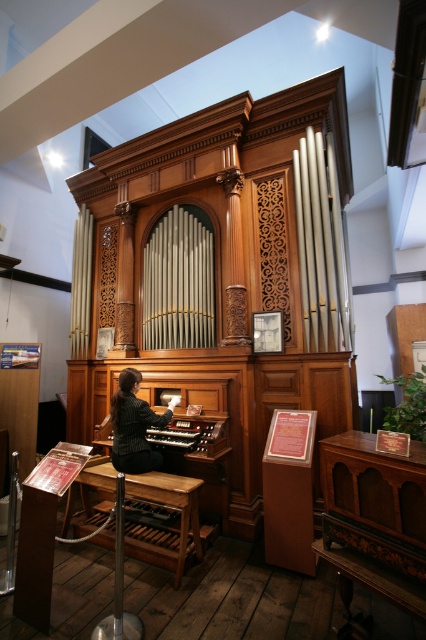
You are an architect designing a new museum exhibit and need to ensure there is enough vertical space for both the black striped blazer at center and the wooden organ at center. Based on the scene, which object is positioned higher up in the image?

The black striped blazer at center is above the wooden organ at center, so it is positioned higher up in the image.

You are standing in front of the pipe organ and want to take a photo. There are two points marked on the organ, point (129, 406) and point (204, 448). Which point will appear larger in your photo?

Point (129, 406) is closer to the camera than point (204, 448), so it will appear larger in the photo.